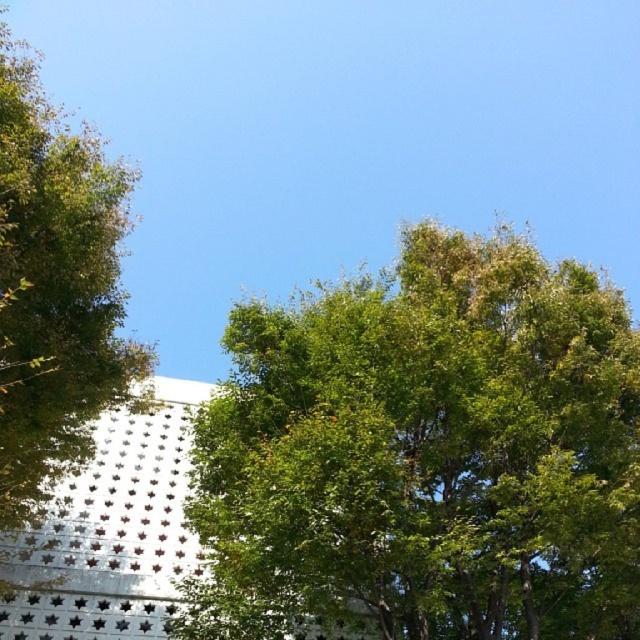
Question: Which point appears farthest from the camera in this image?

Choices:
 (A) (65, 468)
 (B) (269, 524)

Answer: (A)

Question: Which of the following is the farthest from the observer?

Choices:
 (A) green leafy tree at left
 (B) green leafy tree at center

Answer: (B)

Question: Is green leafy tree at center closer to camera compared to green leafy tree at left?

Choices:
 (A) yes
 (B) no

Answer: (B)

Question: Considering the relative positions of green leafy tree at center and green leafy tree at left in the image provided, where is green leafy tree at center located with respect to green leafy tree at left?

Choices:
 (A) above
 (B) below

Answer: (B)

Question: From the image, what is the correct spatial relationship of green leafy tree at center in relation to green leafy tree at left?

Choices:
 (A) left
 (B) right

Answer: (B)

Question: Among these points, which one is farthest from the camera?

Choices:
 (A) (445, 600)
 (B) (132, 360)

Answer: (B)